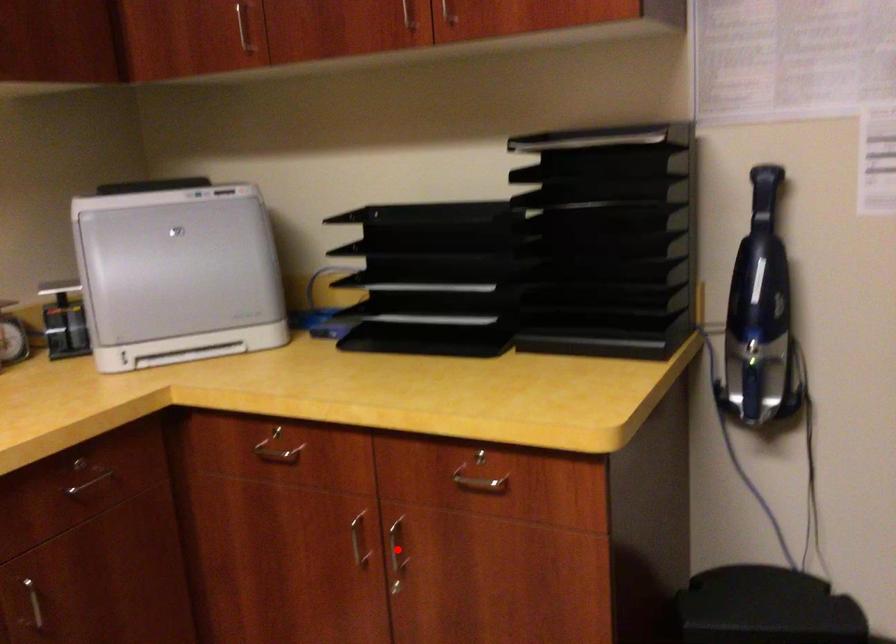
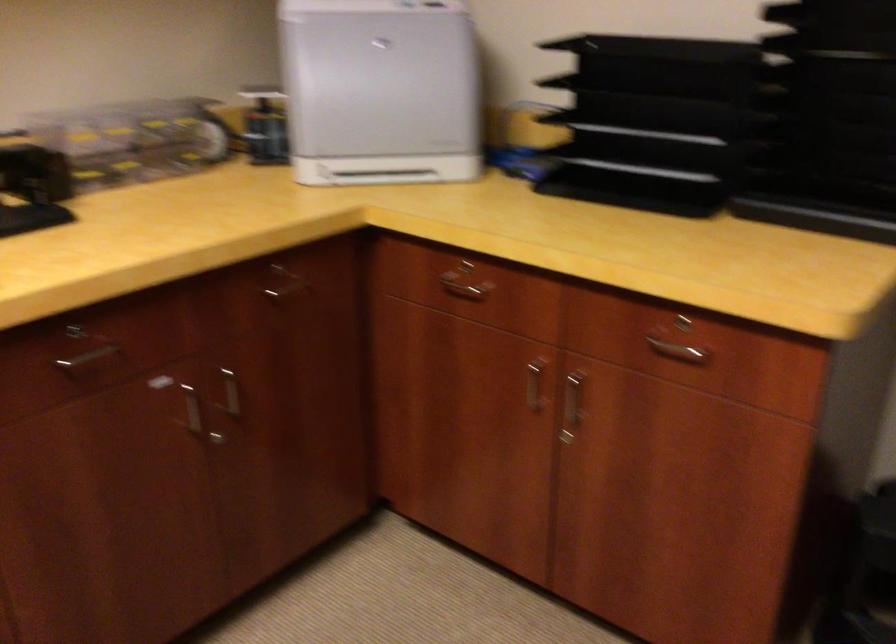
In the second image, find the point that corresponds to the highlighted location in the first image.

(572, 401)